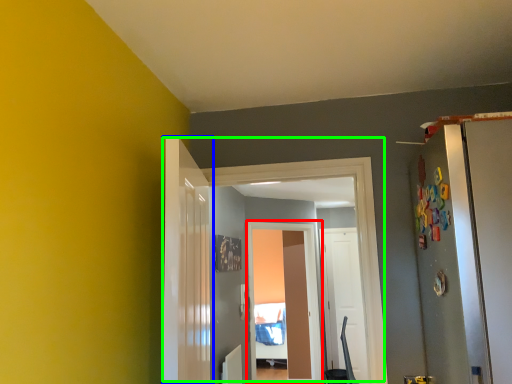
Question: Which is nearer to the screen door (highlighted by a red box)? door (highlighted by a blue box) or door (highlighted by a green box).

Choices:
 (A) door
 (B) door

Answer: (B)